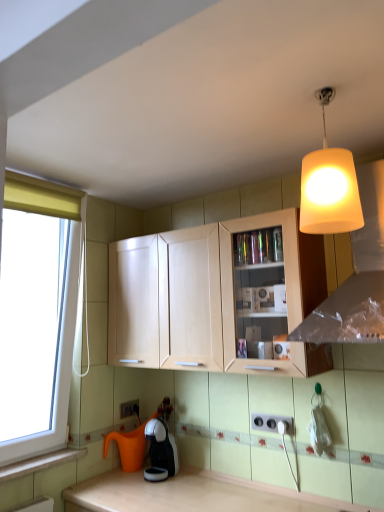
Question: Can you confirm if black glossy coffee machine at lower center is wider than matte white lampshade at upper right?

Choices:
 (A) no
 (B) yes

Answer: (A)

Question: Can you confirm if black glossy coffee machine at lower center is shorter than matte white lampshade at upper right?

Choices:
 (A) yes
 (B) no

Answer: (A)

Question: Is black glossy coffee machine at lower center completely or partially outside of matte white lampshade at upper right?

Choices:
 (A) yes
 (B) no

Answer: (A)

Question: Does black glossy coffee machine at lower center turn towards matte white lampshade at upper right?

Choices:
 (A) yes
 (B) no

Answer: (B)

Question: Does black glossy coffee machine at lower center come behind matte white lampshade at upper right?

Choices:
 (A) no
 (B) yes

Answer: (B)

Question: From a real-world perspective, is black glossy coffee machine at lower center on matte white lampshade at upper right?

Choices:
 (A) yes
 (B) no

Answer: (B)

Question: Is matte white lampshade at upper right not near black glossy coffee machine at lower center?

Choices:
 (A) no
 (B) yes

Answer: (B)

Question: From a real-world perspective, is matte white lampshade at upper right on black glossy coffee machine at lower center?

Choices:
 (A) yes
 (B) no

Answer: (A)

Question: Is matte white lampshade at upper right facing towards black glossy coffee machine at lower center?

Choices:
 (A) no
 (B) yes

Answer: (A)

Question: Is matte white lampshade at upper right positioned beyond the bounds of black glossy coffee machine at lower center?

Choices:
 (A) yes
 (B) no

Answer: (A)

Question: Is matte white lampshade at upper right at the left side of black glossy coffee machine at lower center?

Choices:
 (A) no
 (B) yes

Answer: (A)

Question: Is the position of matte white lampshade at upper right less distant than that of black glossy coffee machine at lower center?

Choices:
 (A) no
 (B) yes

Answer: (B)

Question: Does matte white lampshade at upper right have a greater width compared to white plastic electric outlet at lower center, marked as the 2th electric outlet in a front-to-back arrangement?

Choices:
 (A) no
 (B) yes

Answer: (B)